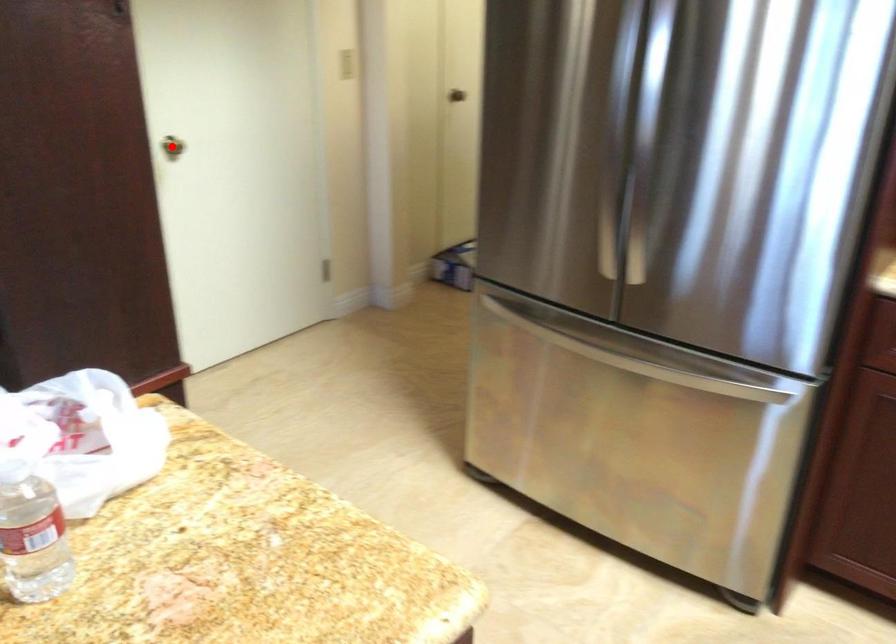
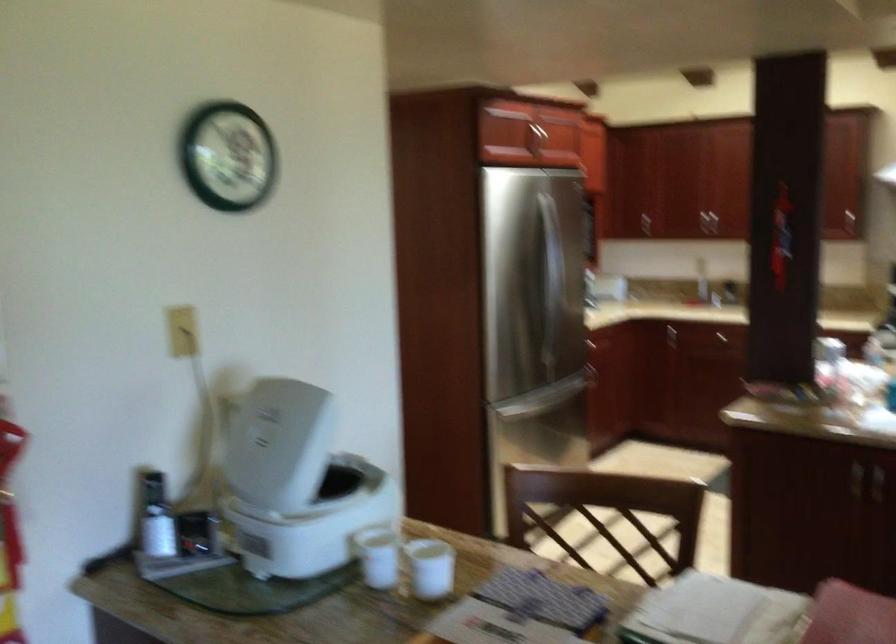
Question: I am providing you with two images of the same scene from different viewpoints. A red point is marked on the first image. At the location where the point appears in image 1, is it still visible in image 2?

Choices:
 (A) Yes
 (B) No

Answer: (B)